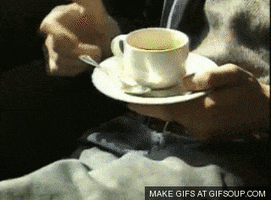
This screenshot has height=200, width=271. What are the coordinates of `coffee cup handle` in the screenshot? It's located at (113, 44).